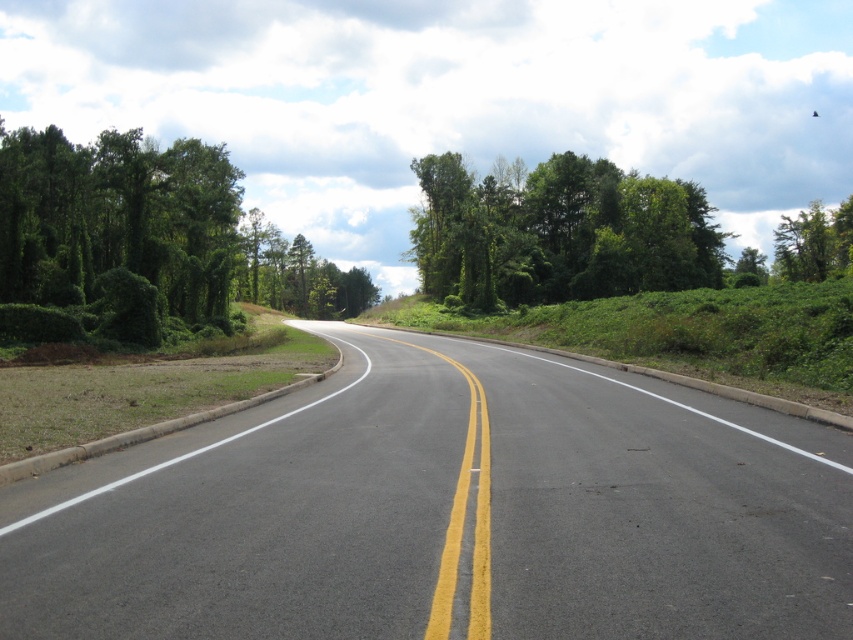
What do you see at coordinates (445, 513) in the screenshot? The image size is (853, 640). I see `asphalt road at center` at bounding box center [445, 513].

Is asphalt road at center shorter than green leafy bush at left?

Yes, asphalt road at center is shorter than green leafy bush at left.

This screenshot has width=853, height=640. Identify the location of asphalt road at center. (445, 513).

You are a GUI agent. You are given a task and a screenshot of the screen. Output one action in this format:
    pyautogui.click(x=<x>, y=<y>)
    Task: Click on the asphalt road at center
    
    Given the screenshot: What is the action you would take?
    pyautogui.click(x=445, y=513)

Does point (167, 170) lie in front of point (656, 268)?

Yes, it is.

Who is more distant from viewer, (x=113, y=218) or (x=579, y=195)?

The point (x=579, y=195) is behind.

Locate an element on the screen. The image size is (853, 640). green leafy bush at left is located at coordinates (143, 241).

Does point (318, 397) come behind point (685, 230)?

No, it is in front of (685, 230).

Image resolution: width=853 pixels, height=640 pixels. Find the location of `asphalt road at center`. asphalt road at center is located at coordinates (445, 513).